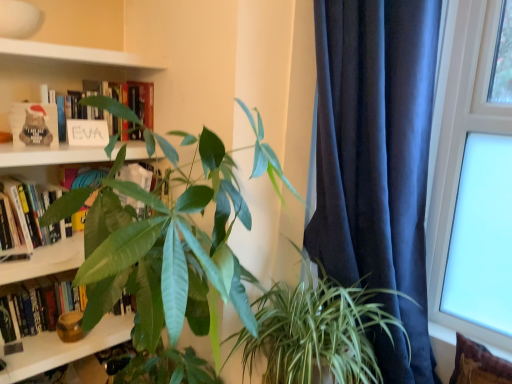
Question: Is brown textured pillow at lower right bigger or smaller than hardcover book at left, acting as the third book starting from the top?

Choices:
 (A) small
 (B) big

Answer: (A)

Question: Is brown textured pillow at lower right to the left or to the right of hardcover book at left, the 1th book ordered from the bottom, in the image?

Choices:
 (A) right
 (B) left

Answer: (A)

Question: Estimate the real-world distances between objects in this image. Which object is closer to the green leafy plant at center, which is the 2th houseplant from left to right?

Choices:
 (A) dark blue velvet curtain at right
 (B) green leafy plant at center, placed as the second houseplant when sorted from right to left
 (C) hardcover book at left, the 1th book ordered from the bottom
 (D) white matte sign at upper left, the third book ordered from the bottom
 (E) transparent glass window at upper right

Answer: (A)

Question: Based on their relative distances, which object is nearer to the green leafy plant at center, which is the 2th houseplant from left to right?

Choices:
 (A) hardcover book at upper left, which is the 2th book in top-to-bottom order
 (B) white matte sign at upper left, the third book ordered from the bottom
 (C) hardcover book at left, acting as the third book starting from the top
 (D) green leafy plant at center, placed as the second houseplant when sorted from right to left
 (E) brown textured pillow at lower right

Answer: (D)